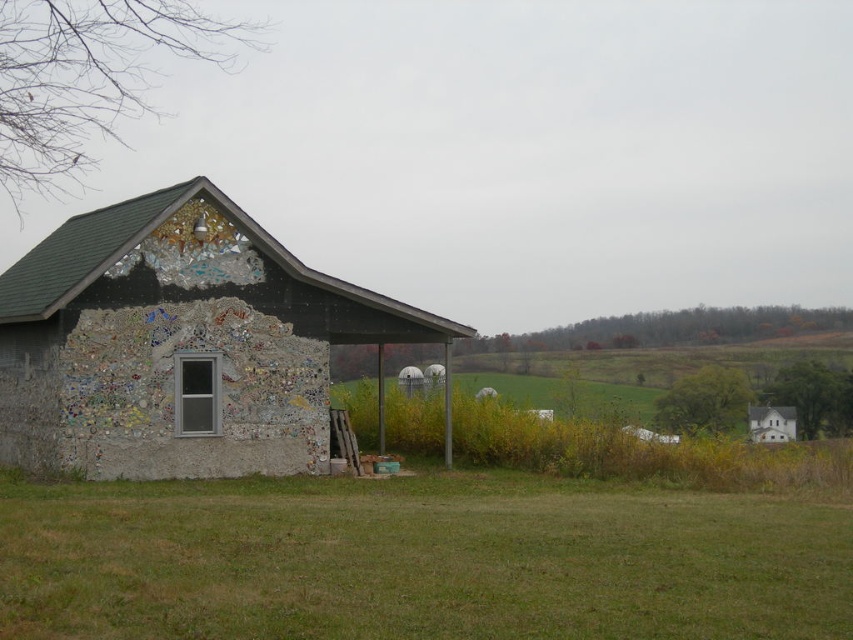
Question: Does green grass at lower left appear under decorative mosaic barn at left?

Choices:
 (A) yes
 (B) no

Answer: (A)

Question: Can you confirm if green grass at lower left is positioned to the right of decorative mosaic barn at left?

Choices:
 (A) yes
 (B) no

Answer: (A)

Question: Is green grass at lower left to the right of decorative mosaic barn at left from the viewer's perspective?

Choices:
 (A) yes
 (B) no

Answer: (A)

Question: Which object appears farthest from the camera in this image?

Choices:
 (A) decorative mosaic barn at left
 (B) green grass at lower left

Answer: (A)

Question: Which point is closer to the camera taking this photo?

Choices:
 (A) (236, 528)
 (B) (347, 336)

Answer: (A)